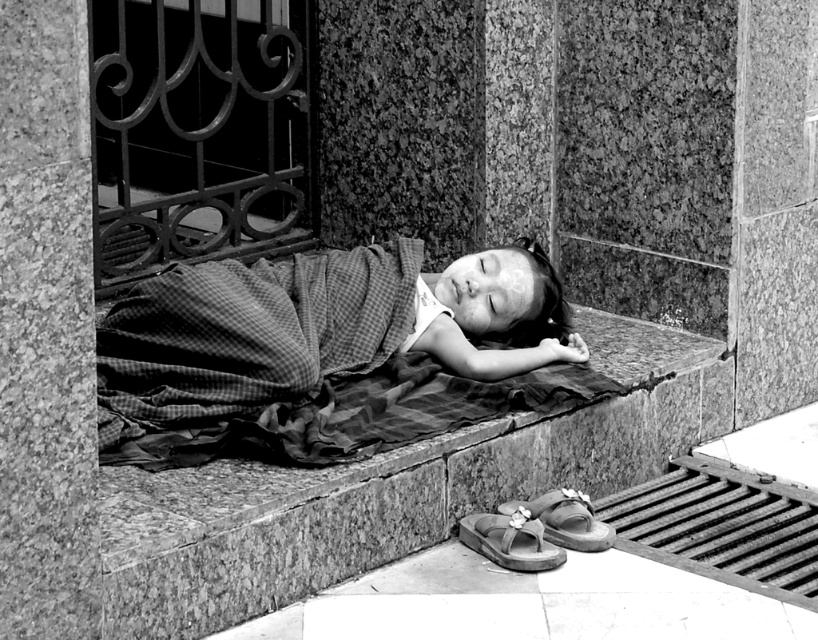
Is checkered fabric blanket at center further to the viewer compared to checkered fabric blanket at lower center?

Yes.

Where is `checkered fabric blanket at center`? The image size is (818, 640). checkered fabric blanket at center is located at coordinates (317, 330).

Between point (151, 353) and point (537, 508), which one is positioned behind?

The point (537, 508) is behind.

The height and width of the screenshot is (640, 818). I want to click on checkered fabric blanket at center, so click(x=317, y=330).

Locate an element on the screen. This screenshot has height=640, width=818. checkered fabric blanket at center is located at coordinates (317, 330).

The height and width of the screenshot is (640, 818). What do you see at coordinates (349, 417) in the screenshot? I see `checkered fabric blanket at lower center` at bounding box center [349, 417].

Can you confirm if checkered fabric blanket at lower center is smaller than matte brown flip-flop at lower center?

No, checkered fabric blanket at lower center is not smaller than matte brown flip-flop at lower center.

Is point (205, 422) farther from camera compared to point (506, 556)?

Yes.

The image size is (818, 640). What are the coordinates of `checkered fabric blanket at lower center` in the screenshot? It's located at (349, 417).